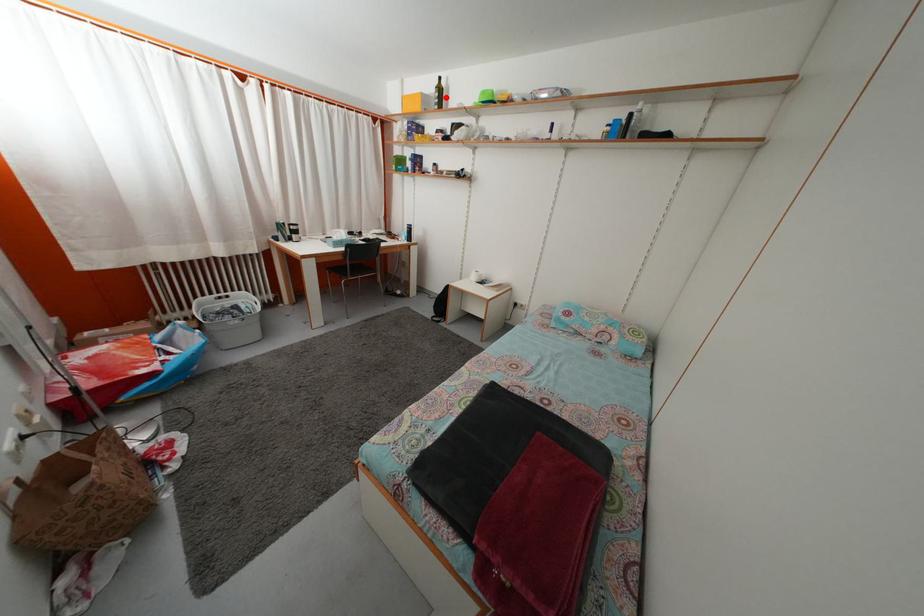
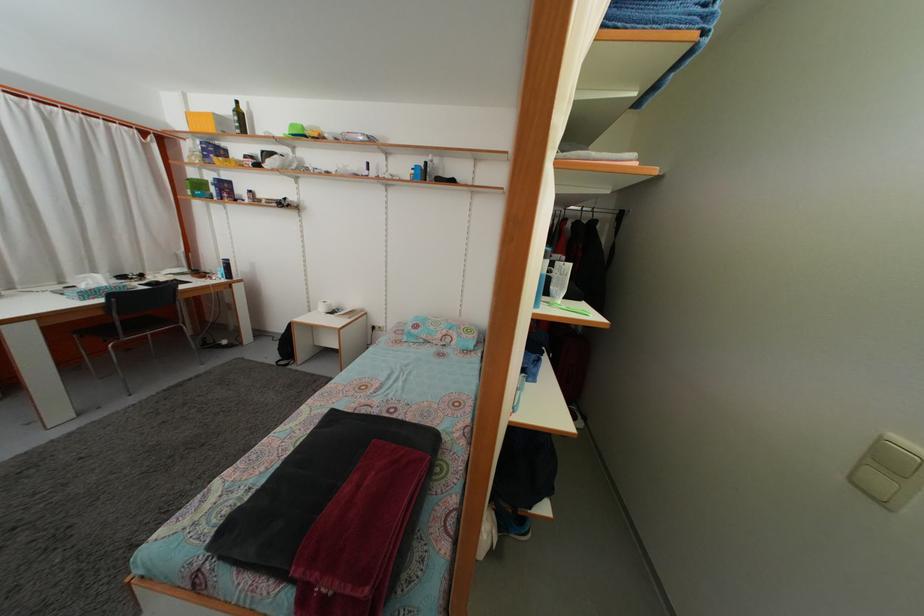
Question: I am providing you with two images of the same scene from different viewpoints. Given a red point in image1, look at the same physical point in image2. Is it:

Choices:
 (A) Closer to the viewpoint
 (B) Farther from the viewpoint

Answer: (B)